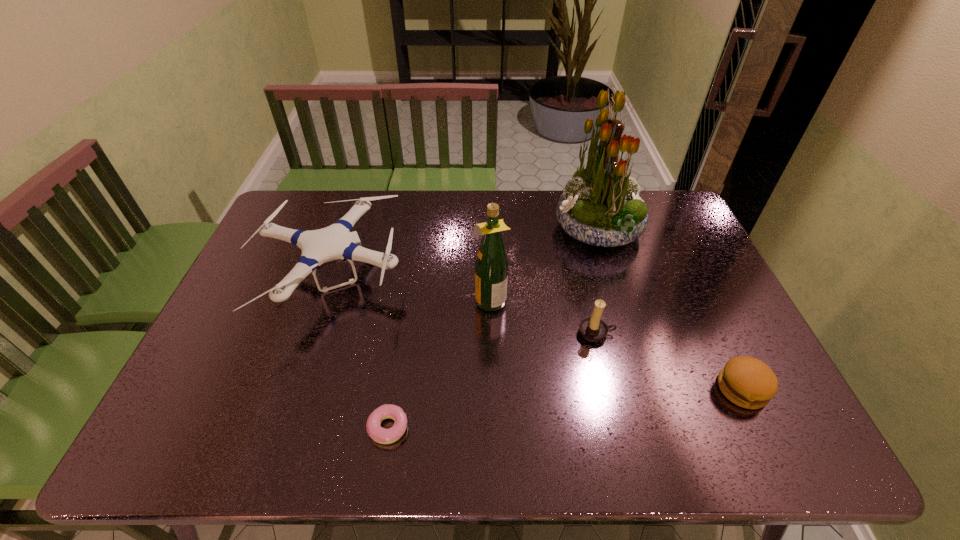
Where is `flower arrangement`? The image size is (960, 540). flower arrangement is located at coordinates (600, 206).

You are a GUI agent. You are given a task and a screenshot of the screen. Output one action in this format:
    pyautogui.click(x=<x>, y=<y>)
    Task: Click on the liquor
    Image resolution: width=960 pixels, height=540 pixels.
    Given the screenshot: What is the action you would take?
    pyautogui.click(x=491, y=265)

What are the coordinates of `the second tallest object` in the screenshot? It's located at (491, 265).

Locate an element on the screen. drone is located at coordinates (334, 242).

Find the location of a particular element. Image resolution: width=960 pixels, height=540 pixels. candle holder is located at coordinates (593, 328).

Locate an element on the screen. the fifth tallest object is located at coordinates [x=747, y=382].

Identify the location of the rightmost object. This screenshot has height=540, width=960. (747, 382).

Find the location of `doughnut`. doughnut is located at coordinates (380, 435).

This screenshot has width=960, height=540. I want to click on vacant position located on the front-facing side of the flower arrangement, so click(x=479, y=229).

At what (x,y) coordinates should I click in order to perform the action: click on vacant space located 0.120m on the front-facing side of the flower arrangement. Please return your answer as a coordinate pair (x, y). The width and height of the screenshot is (960, 540). Looking at the image, I should click on (519, 229).